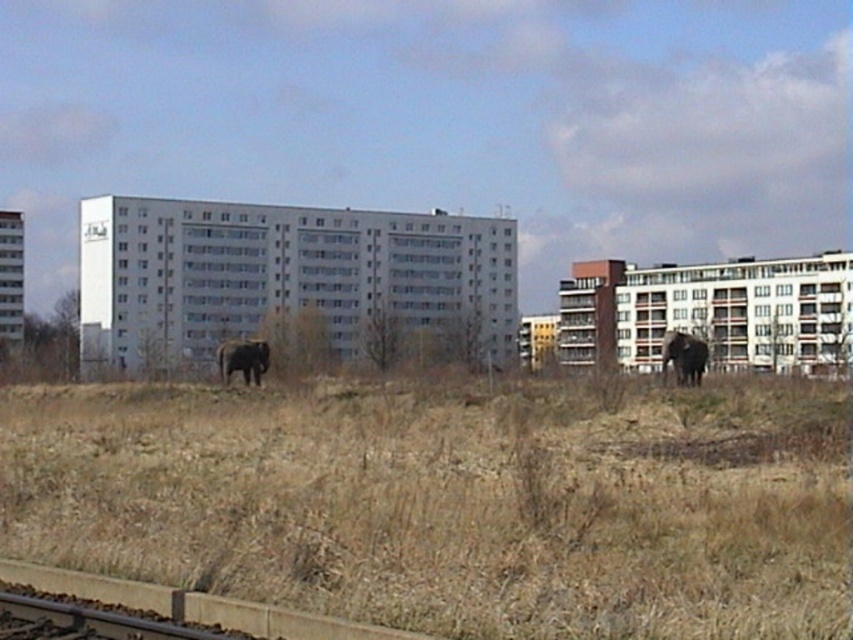
Does point (701, 368) come in front of point (223, 352)?

Yes, it is in front of point (223, 352).

Where is `dark brown elephant at right`? dark brown elephant at right is located at coordinates (683, 356).

Can you confirm if brown dry grass at center is positioned to the right of dark gray elephant at center?

Indeed, brown dry grass at center is positioned on the right side of dark gray elephant at center.

Which is in front, point (492, 438) or point (236, 364)?

Point (492, 438)

Find the location of a particular element. Image resolution: width=853 pixels, height=640 pixels. brown dry grass at center is located at coordinates (451, 500).

Does brown dry grass at center appear over dark brown elephant at right?

No, brown dry grass at center is not above dark brown elephant at right.

Who is positioned more to the right, brown dry grass at center or dark brown elephant at right?

Positioned to the right is dark brown elephant at right.

Describe the element at coordinates (451, 500) in the screenshot. I see `brown dry grass at center` at that location.

The image size is (853, 640). Find the location of `brown dry grass at center`. brown dry grass at center is located at coordinates (451, 500).